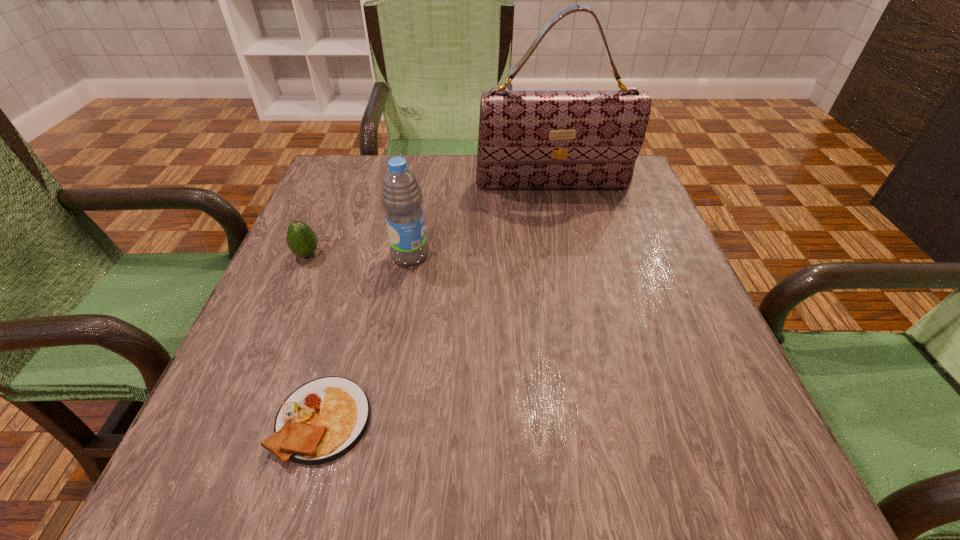
Locate an element on the screen. This screenshot has height=540, width=960. vacant space that's between the omelet and the third tallest object is located at coordinates (315, 337).

Locate an element on the screen. This screenshot has height=540, width=960. free space between the second shortest object and the water bottle is located at coordinates (358, 255).

At what (x,y) coordinates should I click in order to perform the action: click on vacant region between the omelet and the tallest object. Please return your answer as a coordinate pair (x, y). Looking at the image, I should click on (438, 302).

Locate an element on the screen. free point between the shortest object and the second shortest object is located at coordinates (315, 337).

Identify the location of vacant space that's between the water bottle and the tallest object. This screenshot has height=540, width=960. (481, 220).

Locate which object is the closest to the omelet. Please provide its 2D coordinates. Your answer should be formatted as a tuple, i.e. [(x, y)], where the tuple contains the x and y coordinates of a point satisfying the conditions above.

[(401, 196)]

Image resolution: width=960 pixels, height=540 pixels. I want to click on object that can be found as the third closest to the water bottle, so click(322, 420).

This screenshot has width=960, height=540. I want to click on free space that satisfies the following two spatial constraints: 1. on the back side of the second tallest object; 2. on the right side of the nearest object, so click(369, 255).